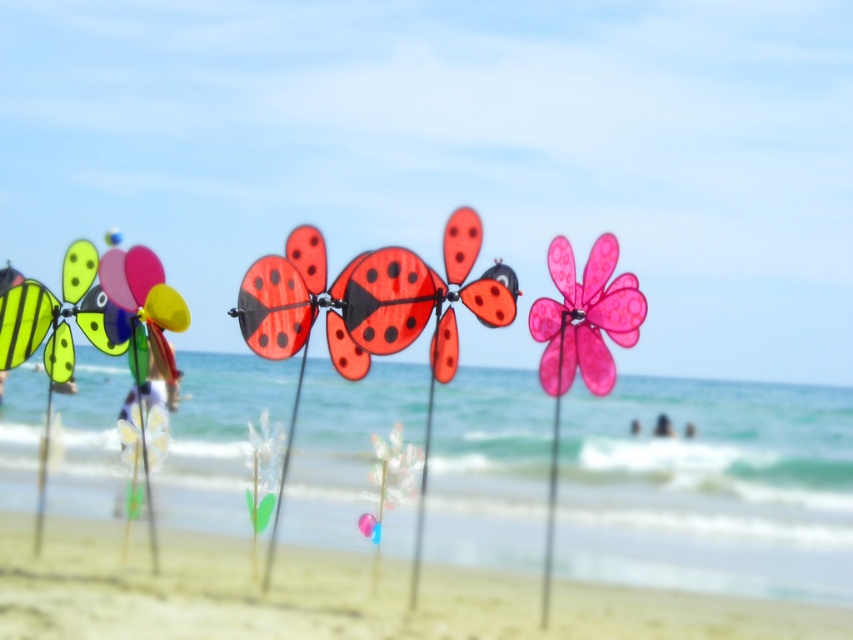
You are a child who wants to place a small toy soldier on the beach between the smooth sand at lower center and the matte plastic butterfly at center. If the toy soldier is 1.5 meters long, will it fit in the space between them?

The smooth sand at lower center is 1.68 meters from the matte plastic butterfly at center. Since the toy soldier is 1.5 meters long, it will fit in the space between them as the distance is greater than the toy soldier length.